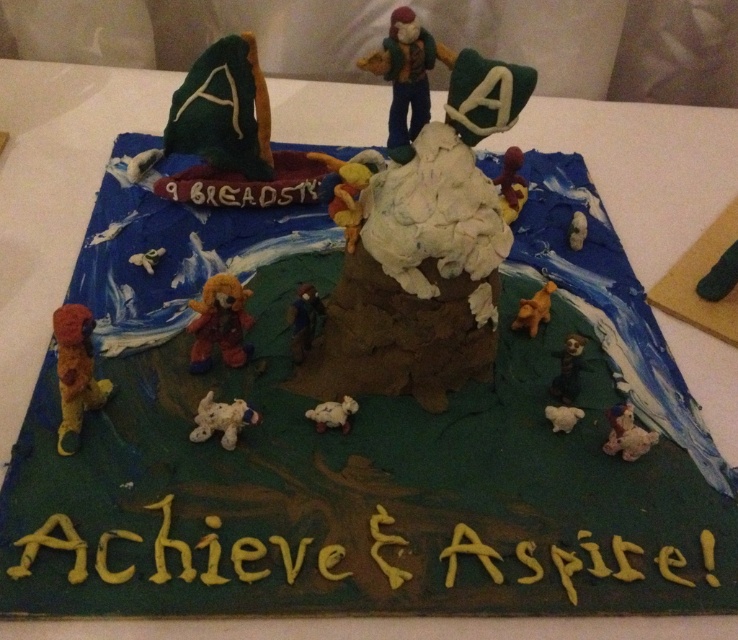
Question: Which of the following is the closest to the observer?

Choices:
 (A) (415, 76)
 (B) (217, 339)
 (C) (528, 324)
 (D) (306, 348)

Answer: (A)

Question: Considering the relative positions of black plastic figure at center and white plastic dog at lower right in the image provided, where is black plastic figure at center located with respect to white plastic dog at lower right?

Choices:
 (A) right
 (B) left

Answer: (B)

Question: Which of these objects is positioned farthest from the white fluffy teddy bear at lower right?

Choices:
 (A) matte red bear at upper right
 (B) white plastic bear at center
 (C) white fluffy sheep at center
 (D) brown plush bear at center

Answer: (D)

Question: Can you confirm if brown plush bear at center is bigger than white plastic dog at lower right?

Choices:
 (A) yes
 (B) no

Answer: (A)

Question: Does black plastic figure at center appear under green felt monkey at lower right?

Choices:
 (A) no
 (B) yes

Answer: (A)

Question: Among these points, which one is farthest from the camera?

Choices:
 (A) (508, 152)
 (B) (576, 385)
 (C) (575, 216)

Answer: (C)